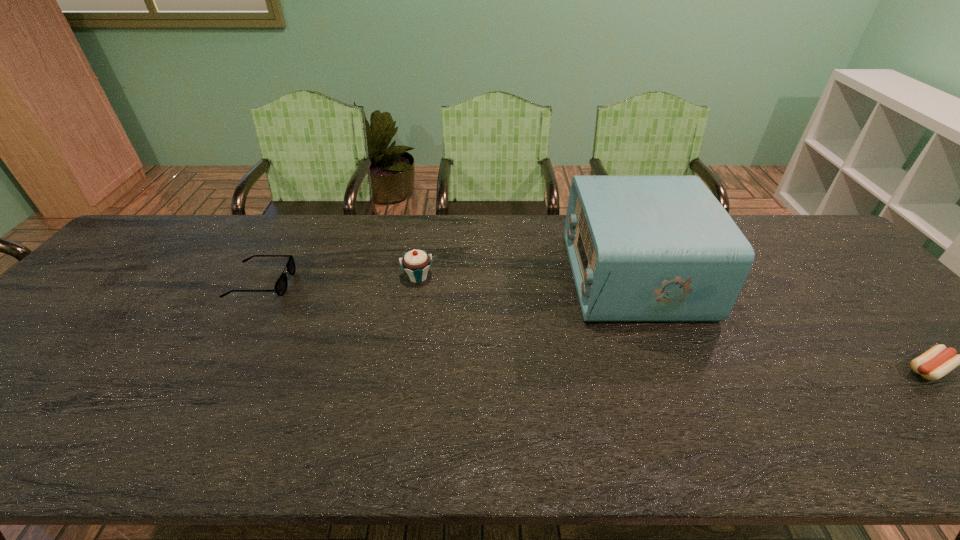
Image resolution: width=960 pixels, height=540 pixels. Identify the location of the third object from left to right. (641, 248).

What are the coordinates of `the tallest object` in the screenshot? It's located at (641, 248).

This screenshot has width=960, height=540. I want to click on the second object from left to right, so pyautogui.click(x=416, y=263).

Locate an element on the screen. Image resolution: width=960 pixels, height=540 pixels. the third shortest object is located at coordinates (416, 263).

This screenshot has height=540, width=960. In order to click on spectacles in this screenshot , I will do `click(280, 288)`.

Locate an element on the screen. free space located on the front panel of the third object from left to right is located at coordinates (540, 276).

Identify the location of free space located 0.170m on the front panel of the third object from left to right. The width and height of the screenshot is (960, 540). (513, 276).

Where is `vacant region located 0.370m on the front panel of the third object from left to right`? The height and width of the screenshot is (540, 960). vacant region located 0.370m on the front panel of the third object from left to right is located at coordinates (443, 276).

Locate an element on the screen. Image resolution: width=960 pixels, height=540 pixels. free space located on the front of the third object from right to left is located at coordinates (397, 403).

This screenshot has height=540, width=960. I want to click on free space located 0.140m on the front-facing side of the spectacles, so point(341,282).